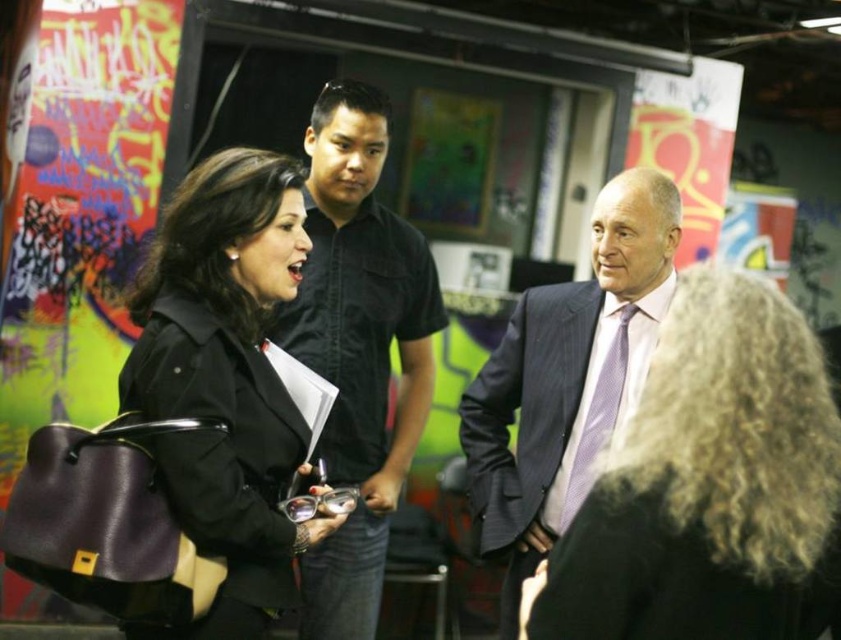
You are standing in the indoor setting described. Where is the matte black jacket at center located in terms of coordinates?

The matte black jacket at center is located at coordinates point (x=225, y=381).

Looking at this image, you are a photographer trying to capture a candid shot of the curly blonde hair at center and the black cotton shirt at center. To ensure both subjects are in frame, you need to know their relative positions. Which object is positioned to the right of the other?

The curly blonde hair at center is to the right of black cotton shirt at center.

You are an assistant helping to organize a clothing donation drive. You have two items to sort out in the image provided. The items are the matte black jacket at center and the black cotton shirt at center. Which of these two items is smaller in size?

The matte black jacket at center is smaller than the black cotton shirt at center, so the smaller item to sort is the matte black jacket at center.